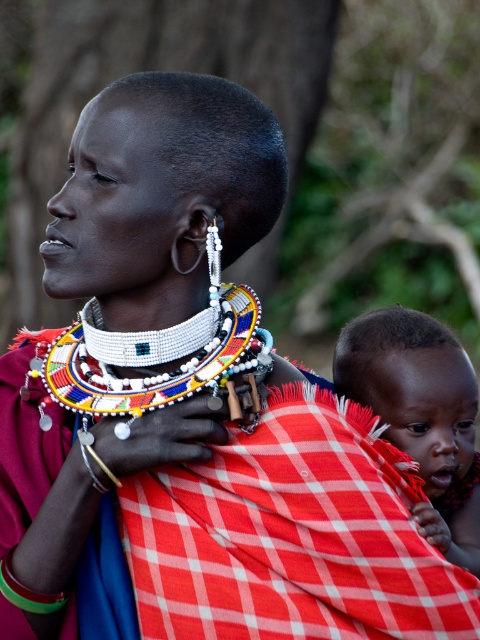
Is matte red cloth at center taller than white beaded necklace at center?

Correct, matte red cloth at center is much taller as white beaded necklace at center.

Is point (429, 324) positioned in front of point (264, 339)?

No, (429, 324) is further to viewer.

The image size is (480, 640). In order to click on matte red cloth at center in this screenshot , I will do `click(420, 413)`.